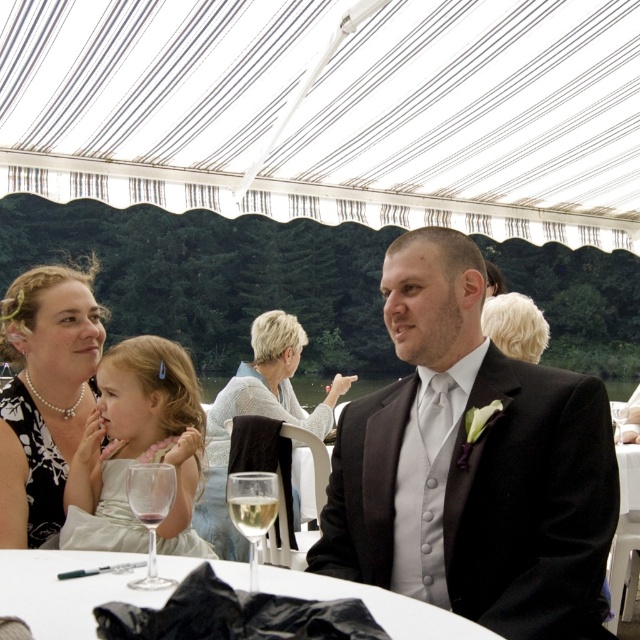
You are a photographer at the event and need to capture a closeup of the matte black suit at center without the clear glass wine at lower center appearing in the frame. Is the width of the suit sufficient to block the wine glass?

The matte black suit at center is wider than the clear glass wine at lower center, so positioning the camera to focus on the suit could potentially block the glass from view if aligned correctly.